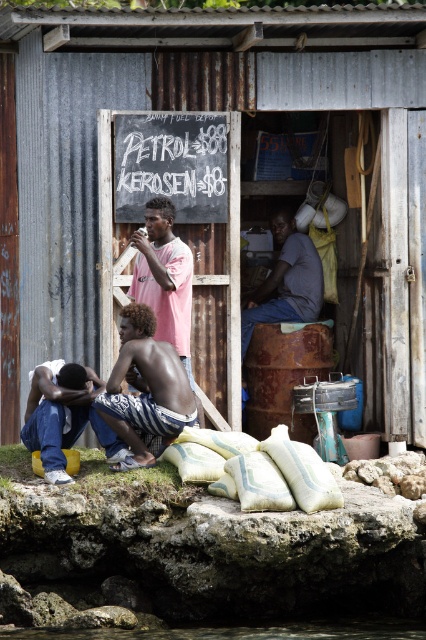
You are a customer at the Bunny Fuel Depot and need to determine if your small camping stove can fit inside the rusty metal barrel at center for transport. The stove is the same height as your denim jeans at lower left. Will it fit vertically?

The rusty metal barrel at center is much taller than the denim jeans at lower left. Since the stove is the same height as the denim jeans at lower left, it will fit vertically inside the rusty metal barrel at center.